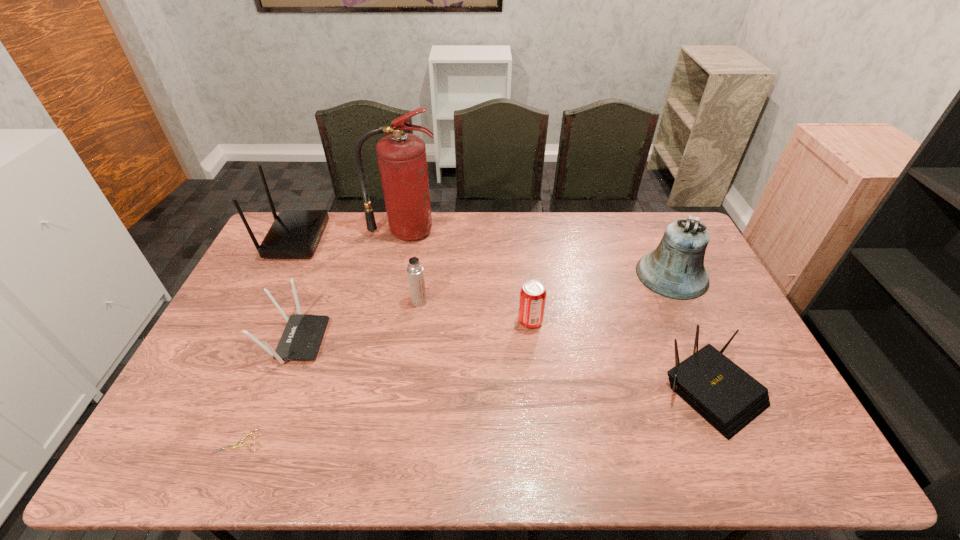
In order to click on vacant space that satisfies the following two spatial constraints: 1. on the front-facing side of the thermos bottle; 2. on the left side of the tallest router in this screenshot , I will do `click(265, 301)`.

This screenshot has width=960, height=540. In order to click on free region that satisfies the following two spatial constraints: 1. on the front-facing side of the second shortest router; 2. on the back side of the shortest router in this screenshot , I will do `click(276, 392)`.

What are the coordinates of `vacant point that satisfies the following two spatial constraints: 1. at the front of the third object from right to left where the nozzle is aimed; 2. on the left side of the fire extinguisher` in the screenshot? It's located at (386, 321).

Find the location of a particular element. vacant region that satisfies the following two spatial constraints: 1. at the front of the tallest object where the nozzle is aimed; 2. on the right side of the bell is located at coordinates (396, 275).